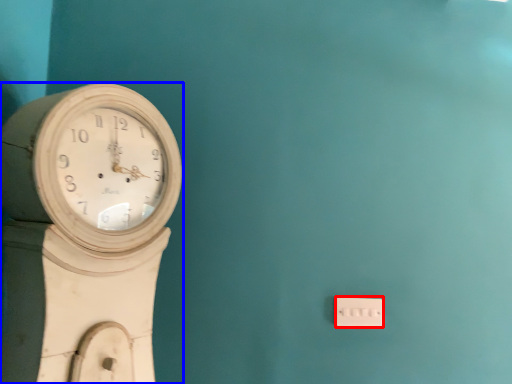
Question: Which point is closer to the camera, electric outlet (highlighted by a red box) or wall clock (highlighted by a blue box)?

Choices:
 (A) electric outlet
 (B) wall clock

Answer: (B)